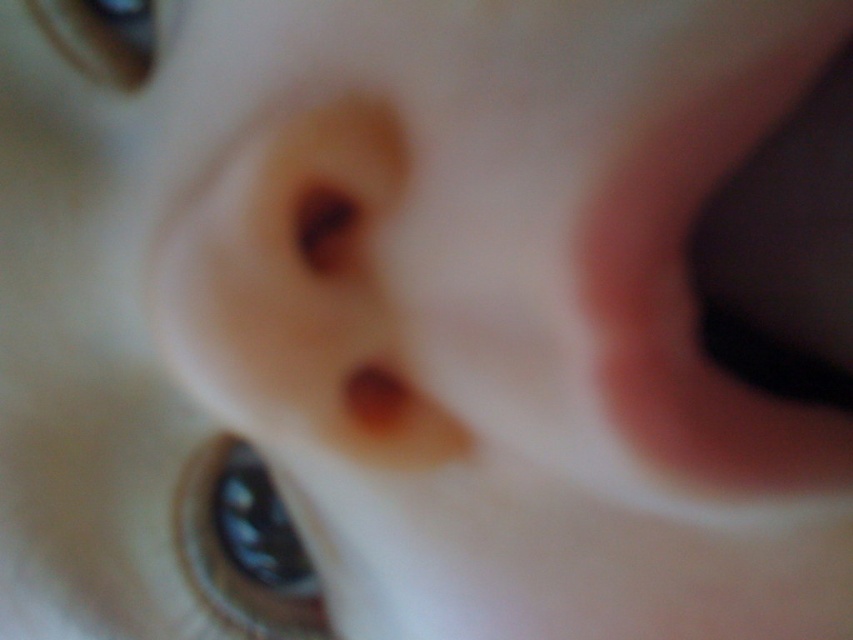
Question: Can you confirm if pink flesh-colored mouth at center is wider than matte black eye at upper left?

Choices:
 (A) yes
 (B) no

Answer: (A)

Question: Which object is the closest to the satin black eye at center?

Choices:
 (A) pink flesh-colored mouth at center
 (B) matte black eye at upper left

Answer: (B)

Question: Which object is farther from the camera taking this photo?

Choices:
 (A) pink flesh-colored mouth at center
 (B) matte black eye at upper left

Answer: (B)

Question: Observing the image, what is the correct spatial positioning of pink flesh-colored mouth at center in reference to satin black eye at center?

Choices:
 (A) above
 (B) below

Answer: (A)

Question: Can you confirm if satin black eye at center is positioned below matte black eye at upper left?

Choices:
 (A) yes
 (B) no

Answer: (A)

Question: Among these objects, which one is farthest from the camera?

Choices:
 (A) pink flesh-colored mouth at center
 (B) matte black eye at upper left

Answer: (B)